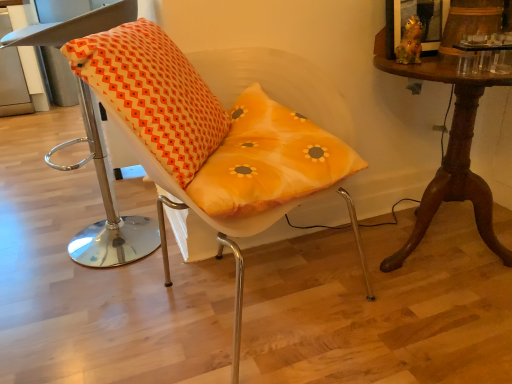
Question: From the image's perspective, relative to translucent orange cushion at center, the second chair when ordered from left to right, is orange fabric cushion at left, which is the first chair from left to right, above or below?

Choices:
 (A) above
 (B) below

Answer: (A)

Question: In terms of height, does orange fabric cushion at left, the second chair viewed from the right, look taller or shorter compared to translucent orange cushion at center, the first chair in the right-to-left sequence?

Choices:
 (A) short
 (B) tall

Answer: (B)

Question: Considering the real-world distances, which object is farthest from the orange printed cushion at left?

Choices:
 (A) mahogany wood table at right
 (B) orange fabric cushion at left, which is the first chair from left to right
 (C) translucent orange cushion at center, the second chair when ordered from left to right

Answer: (A)

Question: Which object is positioned farthest from the orange fabric cushion at left, which is the first chair from left to right?

Choices:
 (A) translucent orange cushion at center, the second chair when ordered from left to right
 (B) mahogany wood table at right
 (C) orange printed cushion at left

Answer: (B)